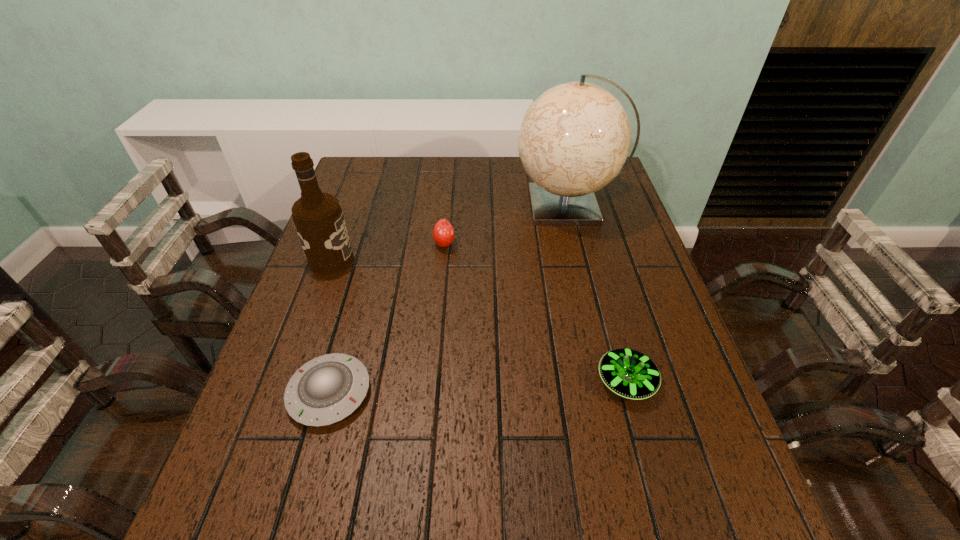
The width and height of the screenshot is (960, 540). I want to click on object that is at the far right corner, so click(575, 137).

In the image, there is a desktop. What are the coordinates of `free region at the far edge` in the screenshot? It's located at (440, 170).

Find the location of `free space at the left edge of the desktop`. free space at the left edge of the desktop is located at coordinates (287, 440).

The width and height of the screenshot is (960, 540). I want to click on free space at the right edge of the desktop, so click(642, 248).

Locate an element on the screen. The image size is (960, 540). free area in between the globe and the taller saucer is located at coordinates (597, 293).

The width and height of the screenshot is (960, 540). I want to click on unoccupied area between the taller saucer and the alcohol, so click(479, 321).

Where is `vacant point located between the third tallest object and the taller saucer`? This screenshot has height=540, width=960. vacant point located between the third tallest object and the taller saucer is located at coordinates (536, 313).

This screenshot has width=960, height=540. What are the coordinates of `free spot between the second tallest object and the shortest object` in the screenshot? It's located at (330, 326).

This screenshot has height=540, width=960. In order to click on vacant space that's between the third shortest object and the shortest object in this screenshot , I will do `click(387, 318)`.

Where is `free space that is in between the fourth shortest object and the apple`? free space that is in between the fourth shortest object and the apple is located at coordinates (388, 252).